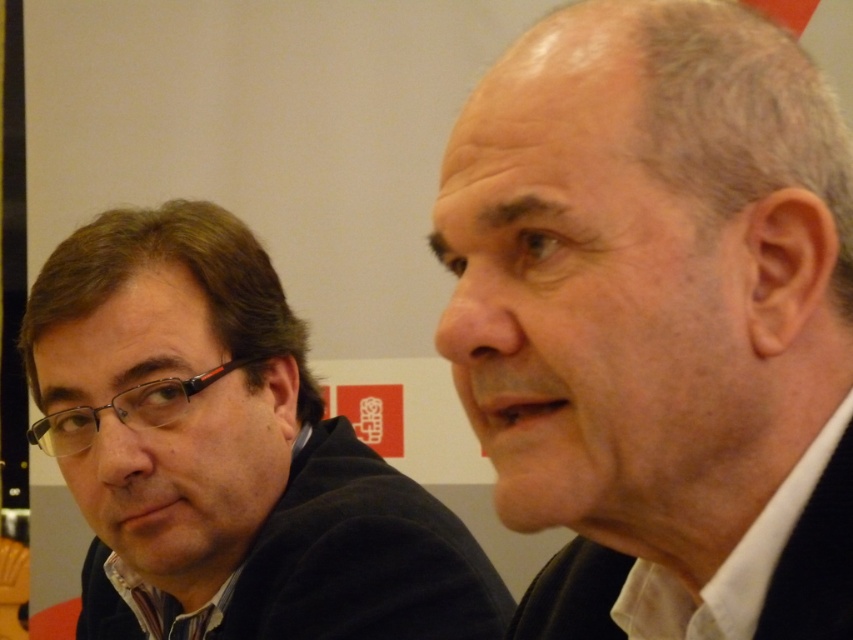
Question: Can you confirm if white matte suit at center is smaller than dark brown hair at left?

Choices:
 (A) yes
 (B) no

Answer: (A)

Question: Which of the following is the farthest from the observer?

Choices:
 (A) (283, 600)
 (B) (788, 570)

Answer: (A)

Question: Can you confirm if white matte suit at center is positioned below dark brown hair at left?

Choices:
 (A) yes
 (B) no

Answer: (B)

Question: Is white matte suit at center further to camera compared to dark brown hair at left?

Choices:
 (A) no
 (B) yes

Answer: (A)